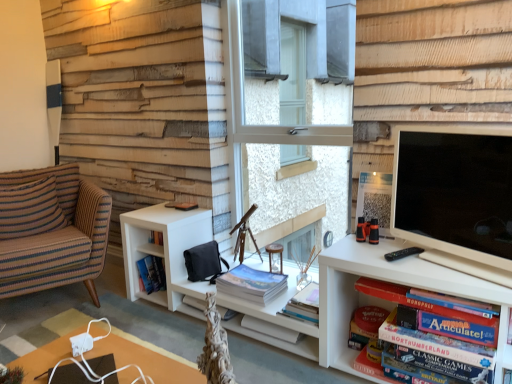
Where is `white paper at center, placed as the 1th paperback book when sorted from left to right`? white paper at center, placed as the 1th paperback book when sorted from left to right is located at coordinates (270, 329).

Where is `white plastic table at lower left`? white plastic table at lower left is located at coordinates (146, 361).

In order to click on clear glass window at center in this screenshot , I will do `click(290, 111)`.

At what (x,y) coordinates should I click in order to perform the action: click on striped fabric armchair at left. Please return your answer as a coordinate pair (x, y). The image size is (512, 384). Looking at the image, I should click on (52, 230).

Image resolution: width=512 pixels, height=384 pixels. What are the coordinates of `white paper at center, which ranks as the 2th paperback book in right-to-left order` in the screenshot? It's located at (270, 329).

Is white plastic table at lower left touching matte blue book at center, which is counted as the first book, starting from the back?

white plastic table at lower left and matte blue book at center, which is counted as the first book, starting from the back, are clearly separated.

Does white plastic table at lower left lie behind matte blue book at center, which is the 2th book in front-to-back order?

No, white plastic table at lower left is in front of matte blue book at center, which is the 2th book in front-to-back order.

From the image's perspective, between white plastic table at lower left and matte blue book at center, the 1th book when ordered from left to right, which one is located above?

matte blue book at center, the 1th book when ordered from left to right.

From a real-world perspective, relative to matte blue book at center, which is the 2th book in front-to-back order, is white plastic table at lower left vertically above or below?

Clearly, from a real-world perspective, white plastic table at lower left is above matte blue book at center, which is the 2th book in front-to-back order.

From the image's perspective, would you say matte board game at lower right, placed as the second book when sorted from left to right, is shown under matte blue book at center, which is the 2th book in front-to-back order?

Yes, from the image's perspective, matte board game at lower right, placed as the second book when sorted from left to right, is beneath matte blue book at center, which is the 2th book in front-to-back order.

Is matte board game at lower right, placed as the second book when sorted from left to right, to the right of matte blue book at center, positioned as the second book in right-to-left order, from the viewer's perspective?

Indeed, matte board game at lower right, placed as the second book when sorted from left to right, is positioned on the right side of matte blue book at center, positioned as the second book in right-to-left order.

Which object is wider, matte board game at lower right, placed as the second book when sorted from left to right, or matte blue book at center, the 1th book when ordered from left to right?

matte board game at lower right, placed as the second book when sorted from left to right, is wider.

Can you confirm if matte board game at lower right, placed as the 1th book when sorted from front to back, is shorter than matte blue book at center, positioned as the second book in right-to-left order?

No.

Find the location of a particular element. The width and height of the screenshot is (512, 384). television on the right of matte board game at lower right, which ranks as the first book in right-to-left order is located at coordinates (455, 191).

Based on the photo, between matte white tv at right and matte board game at lower right, which ranks as the first book in right-to-left order, which one is positioned behind?

matte board game at lower right, which ranks as the first book in right-to-left order.

Which of these two, matte white tv at right or matte board game at lower right, which ranks as the first book in right-to-left order, stands taller?

matte white tv at right.

Would you say matte white tv at right is outside matte board game at lower right, placed as the second book when sorted from left to right?

Absolutely, matte white tv at right is external to matte board game at lower right, placed as the second book when sorted from left to right.

Is matte white tv at right aimed at striped fabric pillow at left?

No, matte white tv at right is not aimed at striped fabric pillow at left.

Would you say matte white tv at right is inside or outside striped fabric pillow at left?

matte white tv at right is not enclosed by striped fabric pillow at left.

Which is more to the right, matte white tv at right or striped fabric pillow at left?

Positioned to the right is matte white tv at right.

Relative to striped fabric pillow at left, is matte white tv at right in front or behind?

Clearly, matte white tv at right is in front of striped fabric pillow at left.

Is matte blue book at center, the 1th book when ordered from left to right, thinner than white matte bookcase at center?

Yes.

In the scene shown: Between matte blue book at center, which is counted as the first book, starting from the back, and white matte bookcase at center, which one has larger size?

With larger size is white matte bookcase at center.

Is matte blue book at center, the 1th book when ordered from left to right, shorter than white matte bookcase at center?

Correct, matte blue book at center, the 1th book when ordered from left to right, is not as tall as white matte bookcase at center.

Considering the positions of objects matte blue book at center, the 1th book when ordered from left to right, and white matte bookcase at center in the image provided, who is more to the left, matte blue book at center, the 1th book when ordered from left to right, or white matte bookcase at center?

From the viewer's perspective, matte blue book at center, the 1th book when ordered from left to right, appears more on the left side.

Which object is positioned more to the left, white plastic table at lower left or white matte bookcase at center?

Positioned to the left is white plastic table at lower left.

From the image's perspective, is white plastic table at lower left located beneath white matte bookcase at center?

Correct, white plastic table at lower left appears lower than white matte bookcase at center in the image.

From a real-world perspective, between white plastic table at lower left and white matte bookcase at center, who is vertically higher?

white plastic table at lower left, from a real-world perspective.

Is white plastic table at lower left not inside white matte bookcase at center?

Yes, white plastic table at lower left is outside of white matte bookcase at center.

Is striped fabric armchair at left bigger than white plastic table at lower left?

Yes.

Is white plastic table at lower left at the back of striped fabric armchair at left?

No, white plastic table at lower left is not at the back of striped fabric armchair at left.

Does point (70, 218) come farther from viewer compared to point (110, 352)?

Yes, point (70, 218) is farther from viewer.

What are the coordinates of `table that is in front of the striped fabric armchair at left` in the screenshot? It's located at (146, 361).

Find the location of a particular element. The image size is (512, 384). table above the matte blue book at center, which is the 2th book in front-to-back order (from a real-world perspective) is located at coordinates (146, 361).

Image resolution: width=512 pixels, height=384 pixels. What are the coordinates of `book in front of the matte blue book at center, the 1th book when ordered from left to right` in the screenshot? It's located at (420, 303).

Based on their spatial positions, is matte board game at lower right, placed as the 1th book when sorted from front to back, or matte white tv at right further from clear glass window at center?

Among the two, matte board game at lower right, placed as the 1th book when sorted from front to back, is located further to clear glass window at center.

Based on their spatial positions, is matte board game at lower right, which ranks as the first book in right-to-left order, or striped fabric pillow at left further from hardcover book at lower right, the second paperback book when ordered from left to right?

striped fabric pillow at left is further to hardcover book at lower right, the second paperback book when ordered from left to right.

Looking at the image, which one is located closer to white matte bookcase at center, hardcover book at lower right, which is counted as the first paperback book, starting from the right, or matte board game at lower right, acting as the second book starting from the back?

hardcover book at lower right, which is counted as the first paperback book, starting from the right, is closer to white matte bookcase at center.

From the image, which object appears to be farther from clear glass window at center, white plastic table at lower left or matte board game at lower right, acting as the second book starting from the back?

white plastic table at lower left.

Which object lies nearer to the anchor point matte blue book at center, which is counted as the first book, starting from the back, striped fabric pillow at left or striped fabric armchair at left?

Based on the image, striped fabric armchair at left appears to be nearer to matte blue book at center, which is counted as the first book, starting from the back.

Looking at the image, which one is located further to white matte bookcase at center, hardcover book at lower right, the second paperback book when ordered from left to right, or clear glass window at center?

clear glass window at center is further to white matte bookcase at center.

Which object lies further to the anchor point matte board game at lower right, placed as the 1th book when sorted from front to back, white plastic table at lower left or white matte bookcase at center?

The object further to matte board game at lower right, placed as the 1th book when sorted from front to back, is white plastic table at lower left.

Consider the image. Which object lies nearer to the anchor point striped fabric armchair at left, clear glass window at center or white paper at center, placed as the 1th paperback book when sorted from left to right?

white paper at center, placed as the 1th paperback book when sorted from left to right, is positioned closer to the anchor striped fabric armchair at left.

Identify the location of bookcase between clear glass window at center and matte board game at lower right, which ranks as the first book in right-to-left order, in the vertical direction. (364, 300).

This screenshot has width=512, height=384. I want to click on bookcase located between white plastic table at lower left and matte blue book at center, positioned as the second book in right-to-left order, in the depth direction, so click(x=364, y=300).

Find the location of `bookcase situated between white plastic table at lower left and matte white tv at right from left to right`. bookcase situated between white plastic table at lower left and matte white tv at right from left to right is located at coordinates (364, 300).

Where is `book between striped fabric armchair at left and white paper at center, which ranks as the 2th paperback book in right-to-left order, from left to right`? book between striped fabric armchair at left and white paper at center, which ranks as the 2th paperback book in right-to-left order, from left to right is located at coordinates point(251,284).